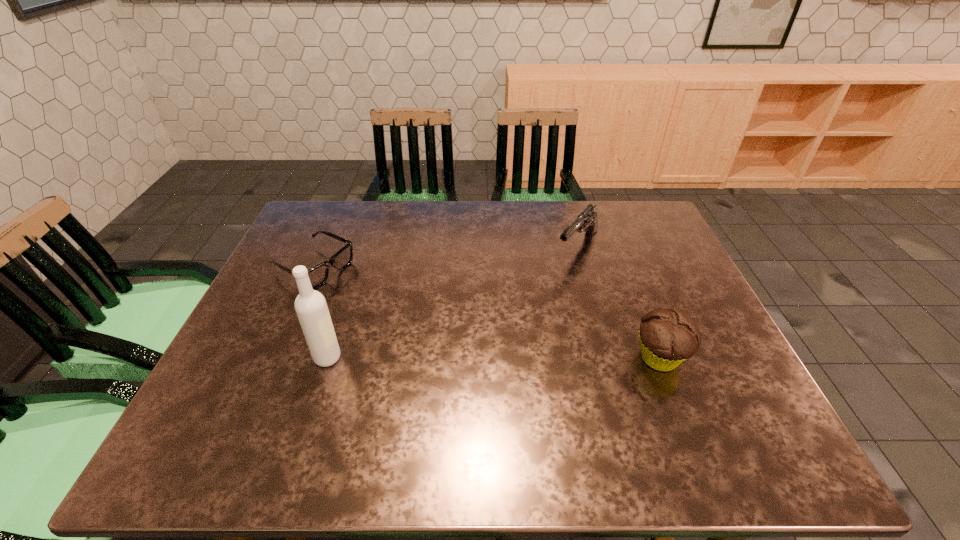
The width and height of the screenshot is (960, 540). I want to click on vacant area at the far right corner, so click(647, 230).

Image resolution: width=960 pixels, height=540 pixels. In order to click on vacant area that lies between the shortest object and the gun in this screenshot , I will do `click(445, 257)`.

This screenshot has height=540, width=960. In order to click on free space that is in between the gun and the muffin in this screenshot , I will do `click(618, 302)`.

In order to click on free space between the sunglasses and the gun in this screenshot , I will do `click(445, 257)`.

At what (x,y) coordinates should I click in order to perform the action: click on vacant region between the sunglasses and the muffin. Please return your answer as a coordinate pair (x, y). The height and width of the screenshot is (540, 960). Looking at the image, I should click on (487, 313).

I want to click on vacant region between the sunglasses and the gun, so pos(445,257).

Find the location of a particular element. The height and width of the screenshot is (540, 960). free point between the muffin and the gun is located at coordinates click(x=618, y=302).

Image resolution: width=960 pixels, height=540 pixels. What are the coordinates of `empty space between the vodka and the muffin` in the screenshot? It's located at (493, 358).

What are the coordinates of `object that stands as the closest to the shortest object` in the screenshot? It's located at (311, 308).

Locate which object ranks second in proximity to the sunglasses. Please provide its 2D coordinates. Your answer should be formatted as a tuple, i.e. [(x, y)], where the tuple contains the x and y coordinates of a point satisfying the conditions above.

[(587, 221)]